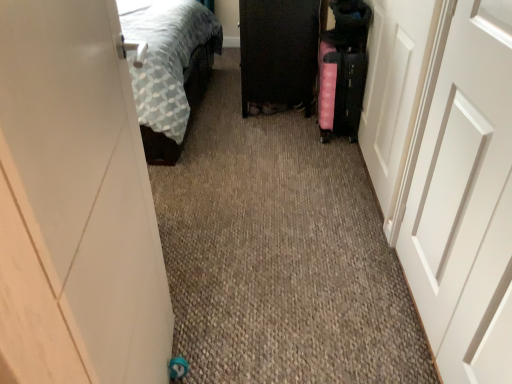
Where is `vacant space behind white matte door at right, placed as the 2th door when sorted from left to right`? vacant space behind white matte door at right, placed as the 2th door when sorted from left to right is located at coordinates (346, 254).